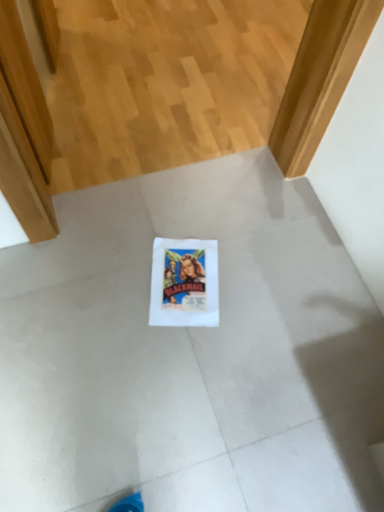
Question: Should I look upward or downward to see white paper flyer at center?

Choices:
 (A) down
 (B) up

Answer: (A)